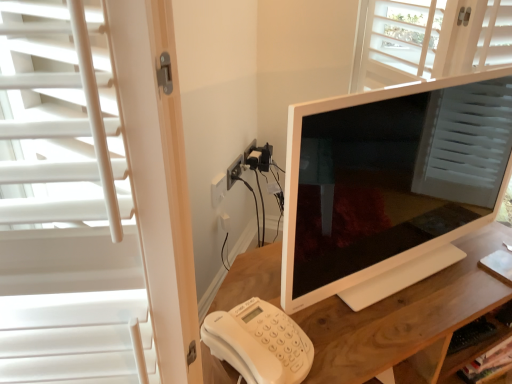
Question: Should I look upward or downward to see wooden desk at center?

Choices:
 (A) up
 (B) down

Answer: (B)

Question: From a real-world perspective, is wooden desk at center below white plastic outlet at center?

Choices:
 (A) yes
 (B) no

Answer: (A)

Question: From the image's perspective, does wooden desk at center appear lower than white plastic outlet at center?

Choices:
 (A) no
 (B) yes

Answer: (B)

Question: Can you confirm if wooden desk at center is shorter than white plastic outlet at center?

Choices:
 (A) no
 (B) yes

Answer: (A)

Question: Is wooden desk at center completely or partially outside of white plastic outlet at center?

Choices:
 (A) no
 (B) yes

Answer: (B)

Question: From the image's perspective, does wooden desk at center appear higher than white plastic outlet at center?

Choices:
 (A) no
 (B) yes

Answer: (A)

Question: Is wooden desk at center turned away from white plastic outlet at center?

Choices:
 (A) yes
 (B) no

Answer: (A)

Question: Is white plastic outlet at center located within white plastic phone at lower left?

Choices:
 (A) no
 (B) yes

Answer: (A)

Question: Would you say white plastic phone at lower left is outside white plastic outlet at center?

Choices:
 (A) no
 (B) yes

Answer: (B)

Question: Is white plastic phone at lower left taller than white plastic outlet at center?

Choices:
 (A) no
 (B) yes

Answer: (B)

Question: Is white plastic phone at lower left far away from white plastic outlet at center?

Choices:
 (A) no
 (B) yes

Answer: (A)

Question: Are white plastic phone at lower left and white plastic outlet at center making contact?

Choices:
 (A) no
 (B) yes

Answer: (A)

Question: Is white plastic phone at lower left oriented towards white plastic outlet at center?

Choices:
 (A) yes
 (B) no

Answer: (B)

Question: Does white glossy monitor at center have a lesser width compared to white plastic phone at lower left?

Choices:
 (A) yes
 (B) no

Answer: (A)